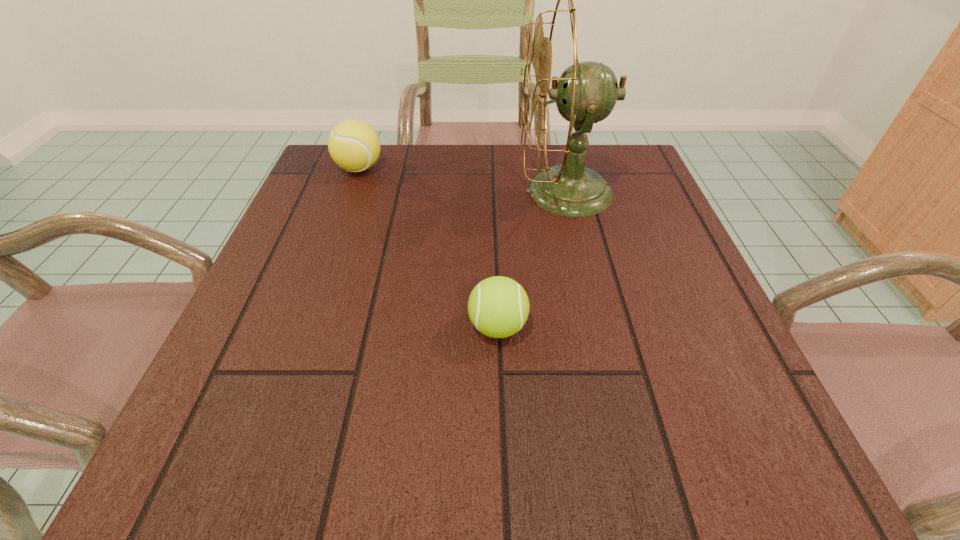
Where is `free spot between the right tennis ball and the second tallest object`? free spot between the right tennis ball and the second tallest object is located at coordinates (428, 247).

Identify the location of vacant area that lies between the shorter tennis ball and the second tallest object. This screenshot has height=540, width=960. (428, 247).

This screenshot has width=960, height=540. Identify the location of unoccupied position between the taller tennis ball and the second object from right to left. (428, 247).

In order to click on the closest object to the leftmost object in this screenshot , I will do `click(586, 93)`.

You are a GUI agent. You are given a task and a screenshot of the screen. Output one action in this format:
    pyautogui.click(x=<x>, y=<y>)
    Task: Click on the object that stands as the closest to the farther tennis ball
    The width and height of the screenshot is (960, 540).
    Given the screenshot: What is the action you would take?
    pyautogui.click(x=586, y=93)

Image resolution: width=960 pixels, height=540 pixels. What are the coordinates of `vacant position in the image that satisfies the following two spatial constraints: 1. on the front side of the second object from left to right; 2. on the left side of the second tallest object` in the screenshot? It's located at (302, 326).

At what (x,y) coordinates should I click in order to perform the action: click on free spot that satisfies the following two spatial constraints: 1. on the front side of the leftmost object; 2. on the right side of the shorter tennis ball. Please return your answer as a coordinate pair (x, y). The image size is (960, 540). Looking at the image, I should click on (302, 326).